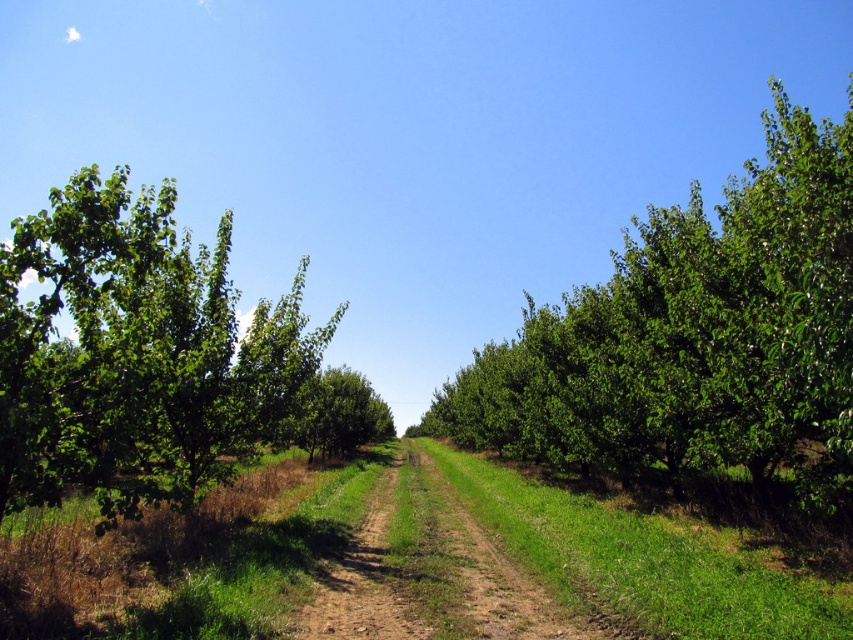
Question: Among these objects, which one is farthest from the camera?

Choices:
 (A) brown dirt track at center
 (B) green leafy tree at center
 (C) green leafy tree at left

Answer: (A)

Question: Does green leafy tree at center have a smaller size compared to green leafy tree at left?

Choices:
 (A) yes
 (B) no

Answer: (B)

Question: Estimate the real-world distances between objects in this image. Which object is farther from the green leafy tree at center?

Choices:
 (A) green leafy tree at left
 (B) brown dirt track at center

Answer: (B)

Question: Which object is positioned farthest from the brown dirt track at center?

Choices:
 (A) green leafy tree at center
 (B) green leafy tree at left

Answer: (A)

Question: Does green leafy tree at center appear on the right side of brown dirt track at center?

Choices:
 (A) yes
 (B) no

Answer: (A)

Question: Does green leafy tree at center have a smaller size compared to brown dirt track at center?

Choices:
 (A) yes
 (B) no

Answer: (B)